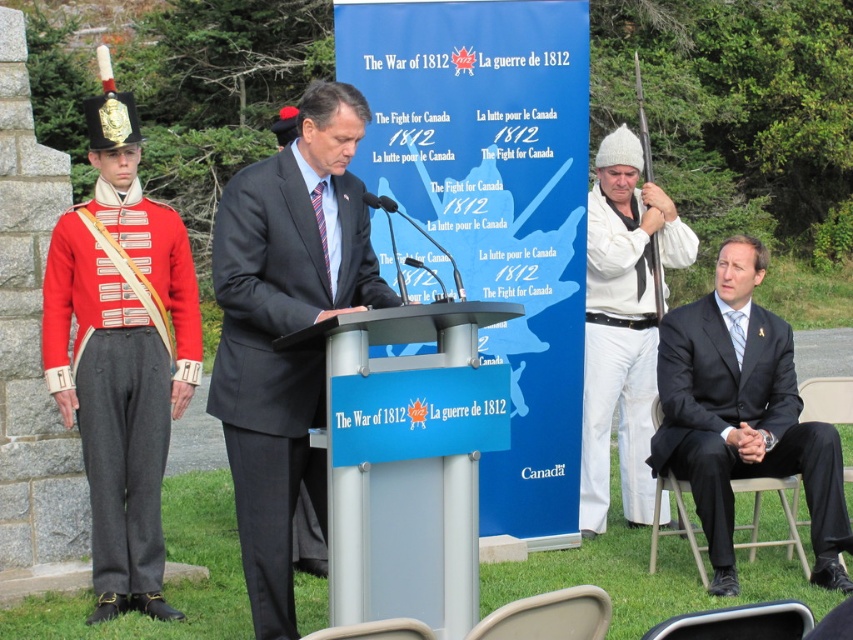
You are an event organizer who needs to set up a photo backdrop for a historical reenactment. The backdrop requires a clear view of both the dark gray suit at center and the metallic silver podium at center. Given their sizes, which object should be placed closer to the camera to ensure both are visible in the photo?

The metallic silver podium at center should be placed closer to the camera because the dark gray suit at center has a larger size. This way, both objects will appear balanced in the photo.

You are attending the historical event and want to take a photo of both the red wool uniform at left and the black suit at right. Since you can only focus on one person at a time, which person should you focus on to ensure both are in the frame?

You should focus on the red wool uniform at left because it is taller than the black suit at right, so positioning the camera to include the taller figure will likely capture both in the frame.